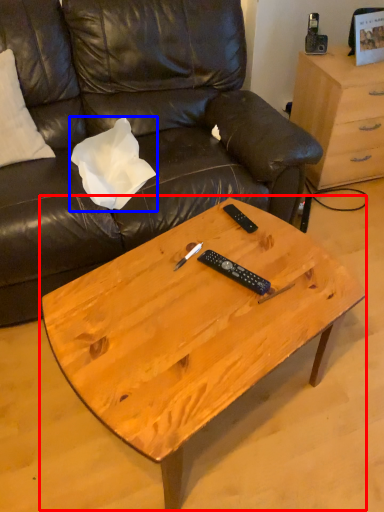
Question: Which object appears closest to the camera in this image, coffee table (highlighted by a red box) or pillow (highlighted by a blue box)?

Choices:
 (A) coffee table
 (B) pillow

Answer: (A)